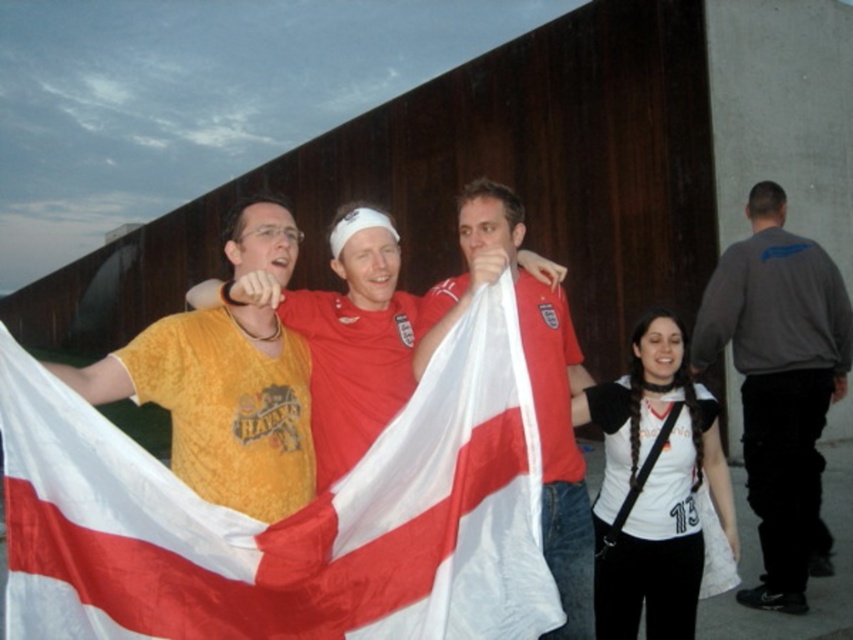
You are a photographer trying to capture a photo of the dark gray sweatshirt at right and the red fabric flag at center. Based on their positions, which object is located to the right of the other?

The dark gray sweatshirt at right is to the right of the red fabric flag at center.